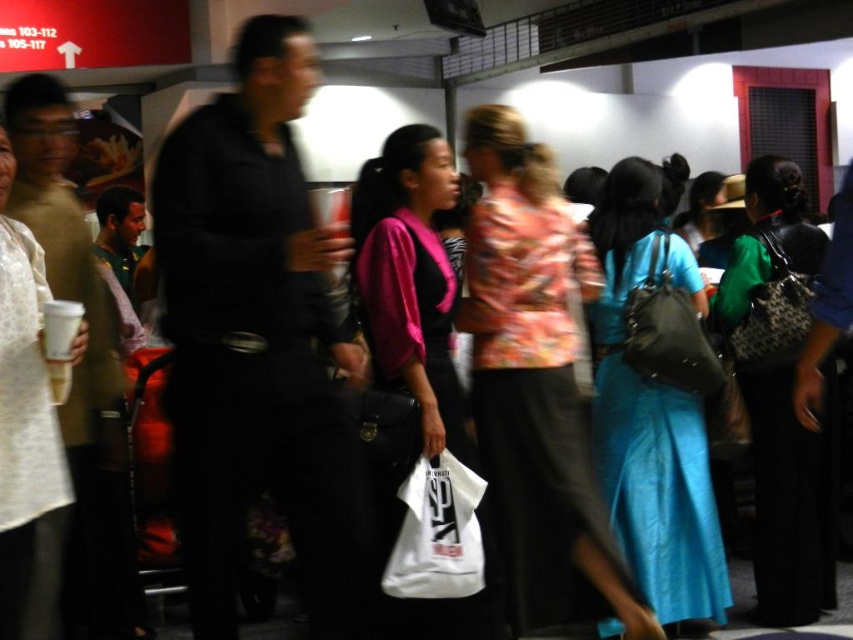
Question: Among these points, which one is nearest to the camera?

Choices:
 (A) (503, 147)
 (B) (370, 212)

Answer: (A)

Question: Which point is farther to the camera?

Choices:
 (A) floral fabric blouse at center
 (B) green textured dress at center
 (C) white matte shirt at left
 (D) matte blue dress at center

Answer: (B)

Question: Among these objects, which one is farthest from the camera?

Choices:
 (A) matte black handbag at center
 (B) white matte shirt at left
 (C) green textured dress at center
 (D) floral fabric blouse at center

Answer: (C)

Question: Can you confirm if pink matte jacket at center is thinner than white matte shirt at left?

Choices:
 (A) yes
 (B) no

Answer: (B)

Question: Does green textured dress at center have a greater width compared to white matte shirt at left?

Choices:
 (A) no
 (B) yes

Answer: (B)

Question: Considering the relative positions of matte blue dress at center and white matte shirt at left in the image provided, where is matte blue dress at center located with respect to white matte shirt at left?

Choices:
 (A) right
 (B) left

Answer: (A)